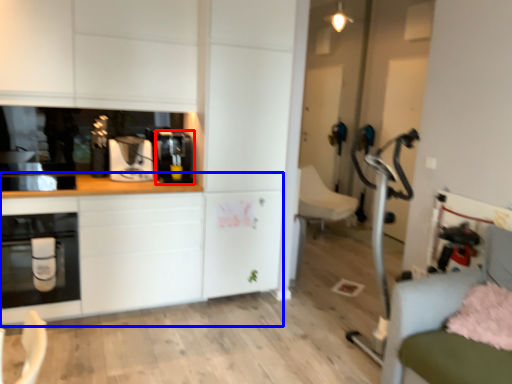
Question: Among these objects, which one is farthest to the camera, coffee machine (highlighted by a red box) or counter top (highlighted by a blue box)?

Choices:
 (A) coffee machine
 (B) counter top

Answer: (A)